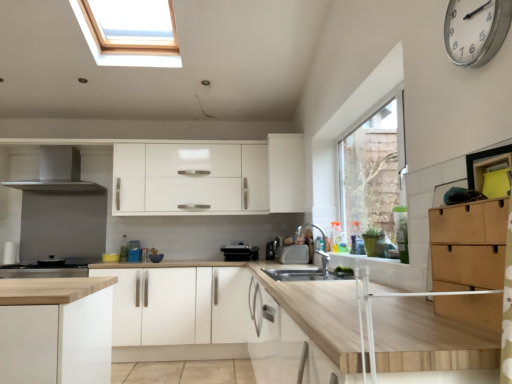
Question: Should I look upward or downward to see satin silver toaster at center, the second appliance viewed from the front?

Choices:
 (A) up
 (B) down

Answer: (B)

Question: Can stainless steel stove at lower left, which is counted as the 2th home appliance, starting from the top, be found inside silver metallic faucet at center?

Choices:
 (A) no
 (B) yes

Answer: (A)

Question: Is silver metallic faucet at center smaller than stainless steel stove at lower left, which is counted as the 2th home appliance, starting from the top?

Choices:
 (A) no
 (B) yes

Answer: (B)

Question: Is silver metallic faucet at center placed right next to stainless steel stove at lower left, which is the first home appliance in bottom-to-top order?

Choices:
 (A) yes
 (B) no

Answer: (B)

Question: From a real-world perspective, is silver metallic faucet at center under stainless steel stove at lower left, which is counted as the 2th home appliance, starting from the top?

Choices:
 (A) yes
 (B) no

Answer: (B)

Question: From the image's perspective, is silver metallic faucet at center under stainless steel stove at lower left, which is the first home appliance in bottom-to-top order?

Choices:
 (A) no
 (B) yes

Answer: (A)

Question: Can you confirm if silver metallic faucet at center is positioned to the left of stainless steel stove at lower left, which is counted as the 2th home appliance, starting from the top?

Choices:
 (A) no
 (B) yes

Answer: (A)

Question: Is white matte cabinet at center, the 3th cabinetry from the top, turned away from light brown wood drawer at right, the first cabinetry from the right?

Choices:
 (A) yes
 (B) no

Answer: (B)

Question: Does white matte cabinet at center, which is counted as the second cabinetry, starting from the front, have a larger size compared to light brown wood drawer at right, the first cabinetry from the right?

Choices:
 (A) yes
 (B) no

Answer: (A)

Question: Is white matte cabinet at center, placed as the 1th cabinetry when sorted from bottom to top, in front of light brown wood drawer at right, arranged as the second cabinetry when ordered from the bottom?

Choices:
 (A) yes
 (B) no

Answer: (B)

Question: Does white matte cabinet at center, which is counted as the 1th cabinetry, starting from the left, have a greater width compared to light brown wood drawer at right, the first cabinetry from the right?

Choices:
 (A) no
 (B) yes

Answer: (B)

Question: Does white matte cabinet at center, the 3th cabinetry from the top, lie behind light brown wood drawer at right, arranged as the second cabinetry when ordered from the bottom?

Choices:
 (A) no
 (B) yes

Answer: (B)

Question: Considering the relative sizes of white matte cabinet at center, which is counted as the second cabinetry, starting from the front, and light brown wood drawer at right, which ranks as the 3th cabinetry in left-to-right order, in the image provided, is white matte cabinet at center, which is counted as the second cabinetry, starting from the front, thinner than light brown wood drawer at right, which ranks as the 3th cabinetry in left-to-right order,?

Choices:
 (A) yes
 (B) no

Answer: (B)

Question: Does black plastic toaster at center, the third appliance positioned from the right, have a larger size compared to white metallic clock at upper right?

Choices:
 (A) yes
 (B) no

Answer: (A)